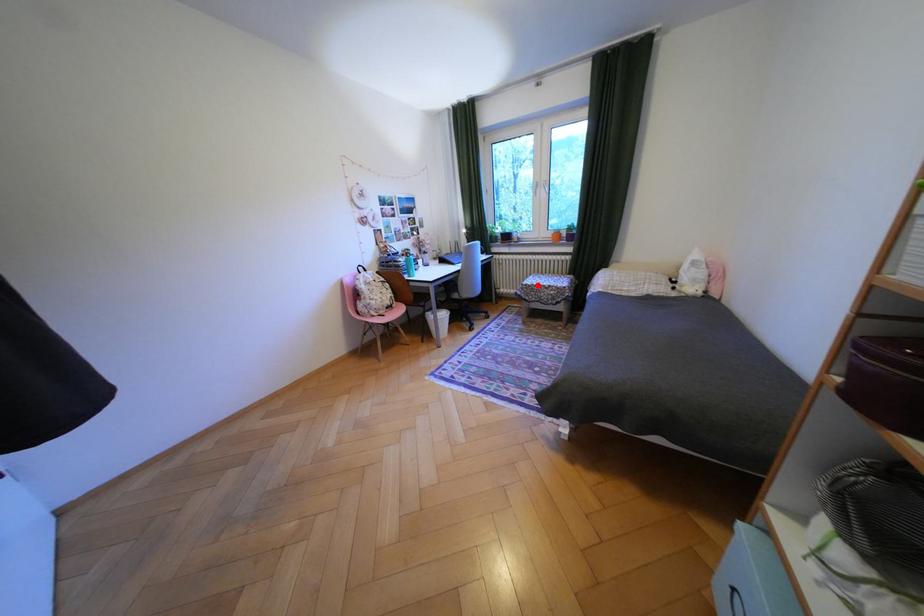
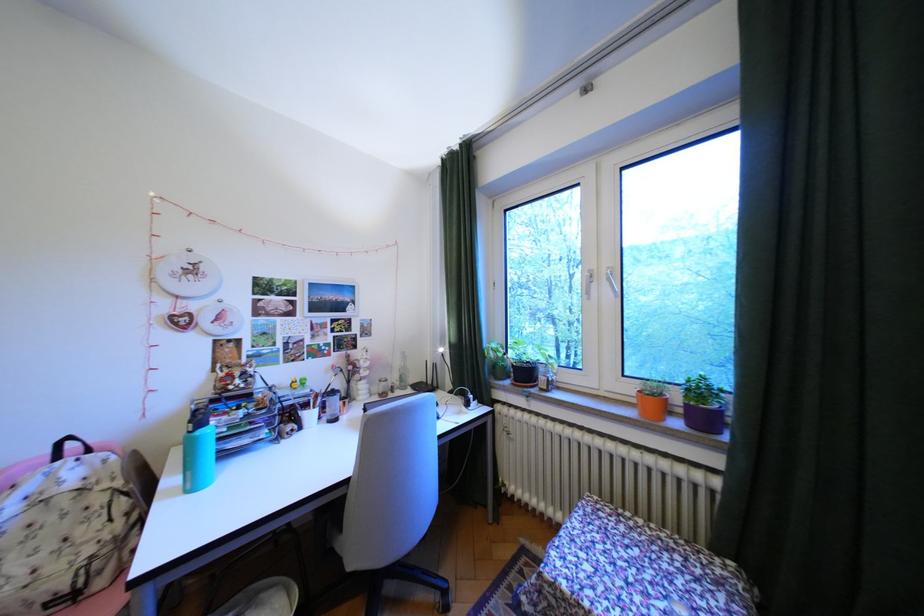
Where in the second image is the point corresponding to the highlighted location from the first image?

(564, 585)